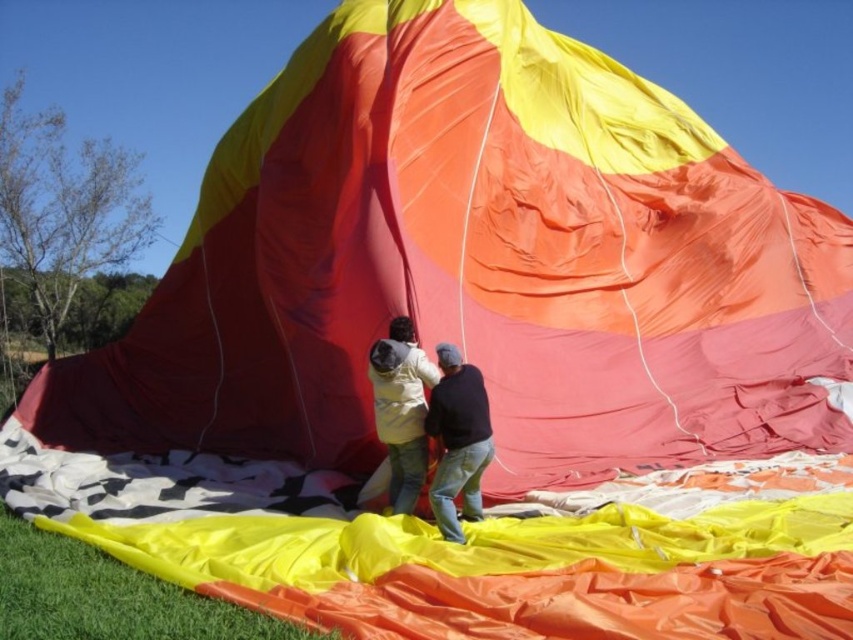
Question: Can you confirm if black matte shirt at center is thinner than matte yellow jacket at center?

Choices:
 (A) yes
 (B) no

Answer: (A)

Question: Which point is farther to the camera?

Choices:
 (A) matte yellow jacket at center
 (B) black matte shirt at center

Answer: (A)

Question: Is black matte shirt at center further to the viewer compared to matte yellow jacket at center?

Choices:
 (A) no
 (B) yes

Answer: (A)

Question: Is black matte shirt at center to the left of matte yellow jacket at center from the viewer's perspective?

Choices:
 (A) yes
 (B) no

Answer: (B)

Question: Which object is farther from the camera taking this photo?

Choices:
 (A) black matte shirt at center
 (B) matte yellow jacket at center

Answer: (B)